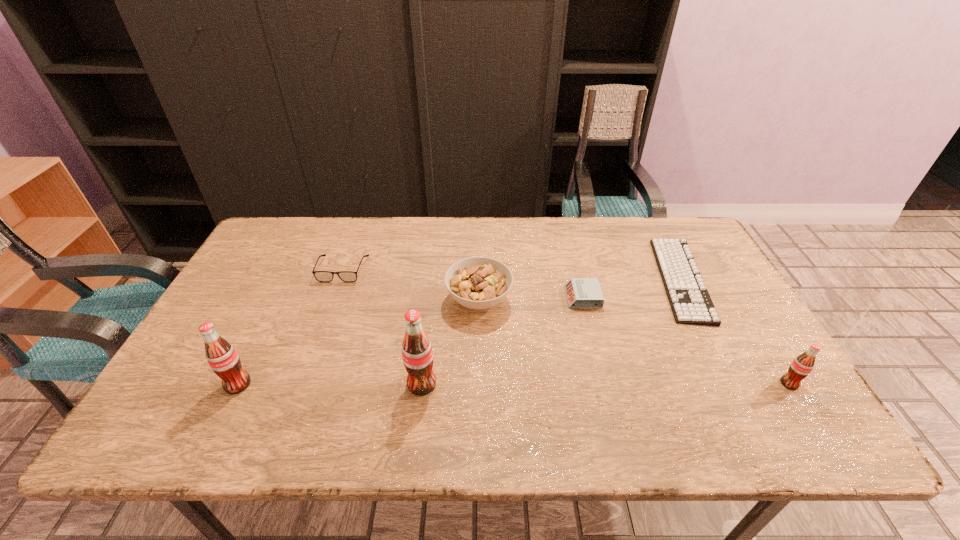
The height and width of the screenshot is (540, 960). I want to click on the second tallest object, so click(x=223, y=359).

Identify the location of the leftmost object. (223, 359).

Where is `the third object from left to right`? the third object from left to right is located at coordinates (417, 353).

The height and width of the screenshot is (540, 960). I want to click on the rightmost soda, so click(800, 368).

The width and height of the screenshot is (960, 540). In order to click on the rightmost object in this screenshot , I will do `click(800, 368)`.

Find the location of a particular element. This screenshot has width=960, height=540. alarm clock is located at coordinates (581, 292).

Locate an element on the screen. Image resolution: width=960 pixels, height=540 pixels. the sixth tallest object is located at coordinates (581, 292).

Identify the location of the second object from left to right. click(x=322, y=276).

You are a GUI agent. You are given a task and a screenshot of the screen. Output one action in this format:
    pyautogui.click(x=<x>, y=<y>)
    Task: Click on the third shortest object
    The width and height of the screenshot is (960, 540).
    Given the screenshot: What is the action you would take?
    pyautogui.click(x=322, y=276)

What are the coordinates of `the shortest object` in the screenshot? It's located at (690, 302).